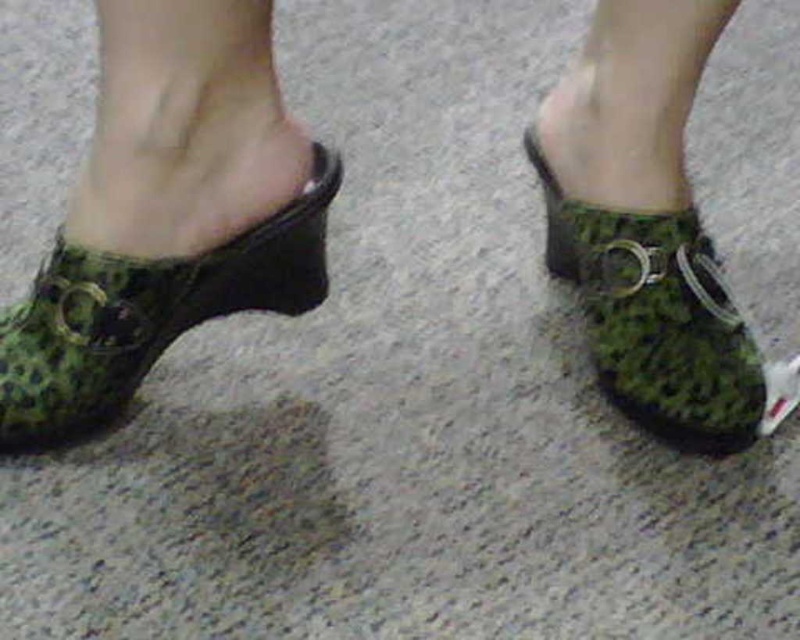
Which is behind, point (80, 410) or point (642, 243)?

The point (642, 243) is behind.

Is green leopard print clogs at center in front of green textured clog at center?

That is True.

Find the location of a particular element. green leopard print clogs at center is located at coordinates (168, 216).

Is green leopard print clog at left shorter than green textured clog at center?

Yes, green leopard print clog at left is shorter than green textured clog at center.

What do you see at coordinates (145, 314) in the screenshot? I see `green leopard print clog at left` at bounding box center [145, 314].

This screenshot has height=640, width=800. I want to click on green leopard print clog at left, so click(145, 314).

Who is lower down, green leopard print clogs at center or green leopard print clog at left?

green leopard print clog at left is lower down.

Is green leopard print clogs at center below green leopard print clog at left?

No.

Which is behind, point (292, 132) or point (237, 307)?

The point (237, 307) is behind.

The height and width of the screenshot is (640, 800). I want to click on green leopard print clogs at center, so click(168, 216).